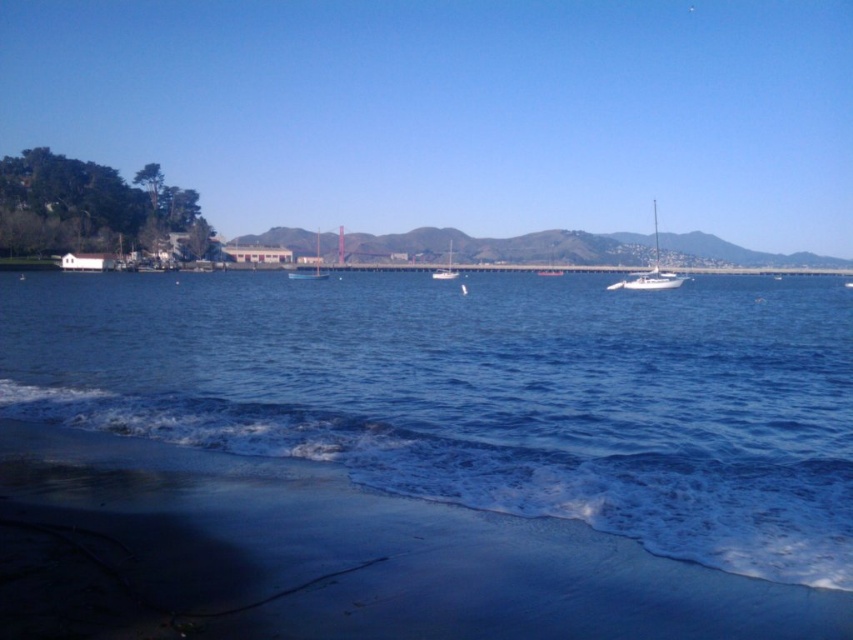
You are standing on the beach and want to take a photo of the point at coordinates (311, 276). Your camera has a maximum zoom range of 80 meters. Can you capture the point clearly without moving closer?

The point at coordinates (311, 276) is 90.56 meters away from the camera, which exceeds the maximum zoom range of 80 meters. Therefore, you cannot capture the point clearly without moving closer.

You are standing on the sandy beach at lower left and want to reach the blue liquid water at lower center. Which direction should you walk to get there?

You should walk towards the direction of the blue liquid water at lower center since it is located at the lower center relative to the sandy beach at lower left.

You are standing on the sandy beach at lower left and want to reach the blue liquid water at lower center. How does the height difference between them affect your path?

The blue liquid water at lower center is much taller than the sandy beach at lower left, so you will have to climb up to reach it.